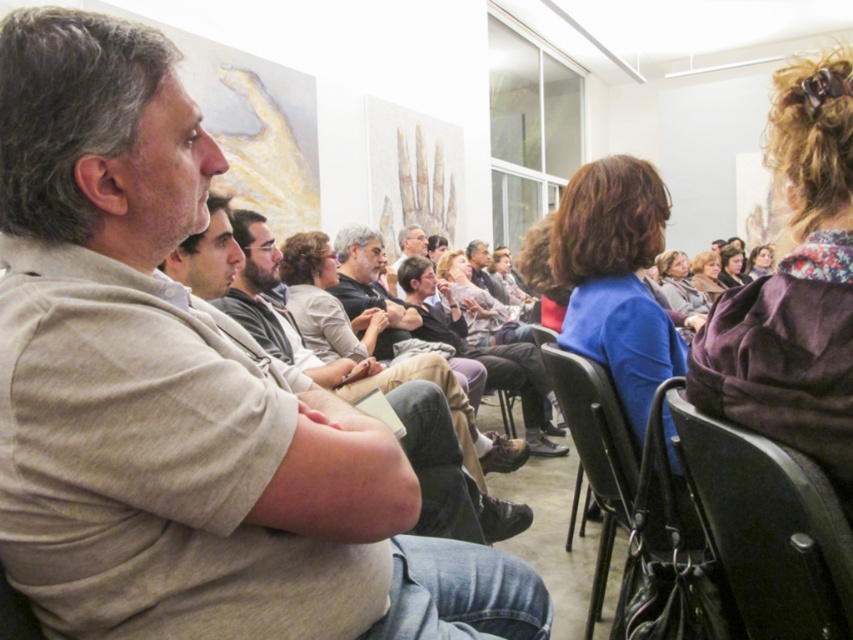
Question: Which of the following is the closest to the observer?

Choices:
 (A) gray wool scarf at center
 (B) blue fabric jacket at center
 (C) black plastic chair at center
 (D) dark gray sweater at center

Answer: (B)

Question: Is dark gray sweater at center smaller than light brown hair at center?

Choices:
 (A) no
 (B) yes

Answer: (A)

Question: Which point is closer to the camera?

Choices:
 (A) (735, 272)
 (B) (787, 115)
 (C) (763, 259)
 (D) (718, 506)

Answer: (B)

Question: Is black plastic chair at lower right behind blue fabric jacket at center?

Choices:
 (A) yes
 (B) no

Answer: (B)

Question: Which point is farther to the camera?

Choices:
 (A) black plastic chair at center
 (B) matte blue shirt at center
 (C) matte brown hair at upper right

Answer: (C)

Question: Can you confirm if matte blue shirt at center is positioned above floral fabric scarf at upper right?

Choices:
 (A) no
 (B) yes

Answer: (A)